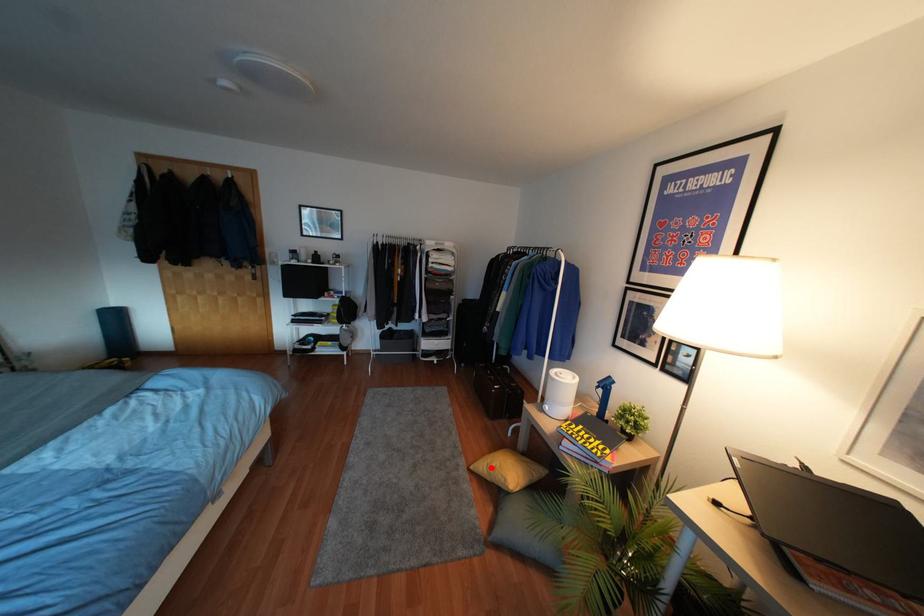
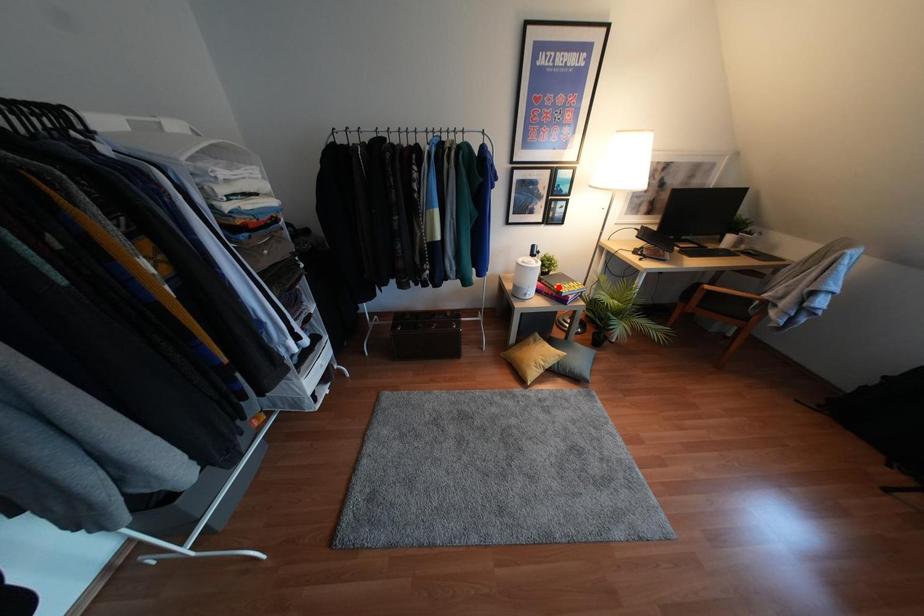
I am providing you with two images of the same scene from different viewpoints. A red point is marked on the first image and another point is marked on the second image. Are the points marked in image1 and image2 representing the same 3D position?

No